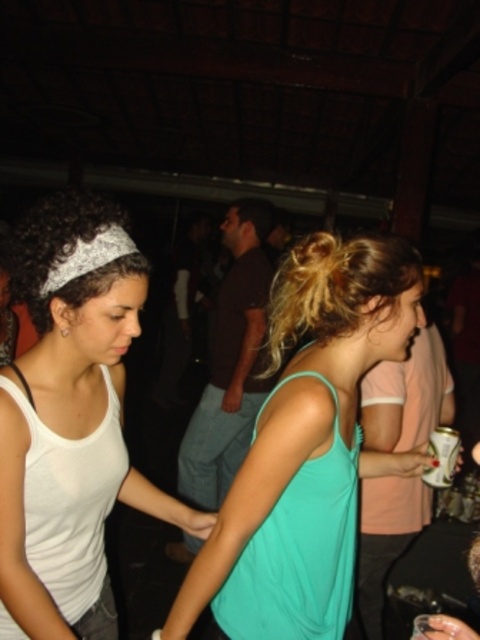
Question: Is teal fabric tank top at center further to camera compared to white fabric tank top at left?

Choices:
 (A) no
 (B) yes

Answer: (B)

Question: Which point is closer to the camera taking this photo?

Choices:
 (A) (88, 307)
 (B) (183, 580)

Answer: (A)

Question: Is teal fabric tank top at center below white fabric tank top at left?

Choices:
 (A) yes
 (B) no

Answer: (A)

Question: Which point is farther from the camera taking this photo?

Choices:
 (A) (12, 241)
 (B) (364, 285)

Answer: (B)

Question: Is teal fabric tank top at center in front of white fabric tank top at left?

Choices:
 (A) no
 (B) yes

Answer: (A)